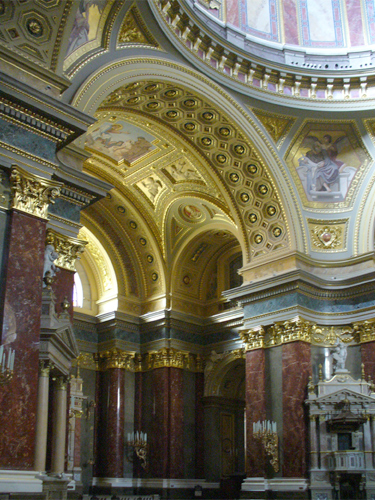
Where is `maroon beams`? maroon beams is located at coordinates pyautogui.click(x=116, y=393), pyautogui.click(x=169, y=404), pyautogui.click(x=252, y=366), pyautogui.click(x=299, y=364), pyautogui.click(x=368, y=362).